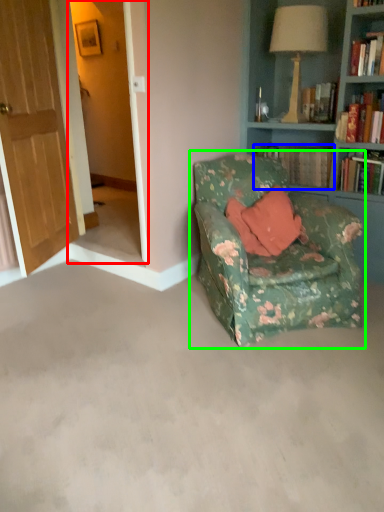
Question: Estimate the real-world distances between objects in this image. Which object is farther from screen door (highlighted by a red box), book (highlighted by a blue box) or chair (highlighted by a green box)?

Choices:
 (A) book
 (B) chair

Answer: (B)